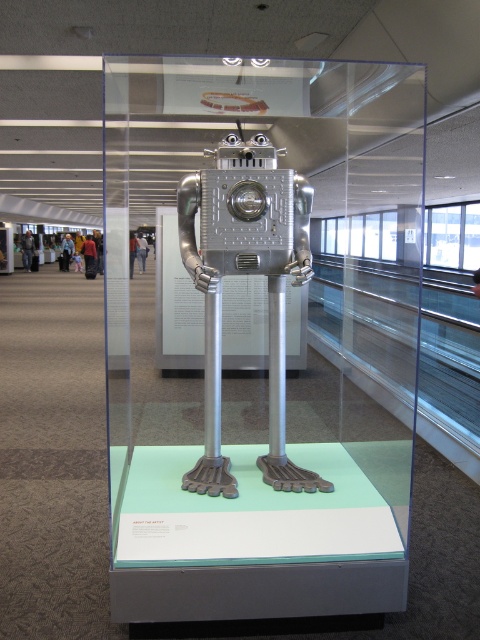
You are an art curator planning to move the transparent glass robot at center and the metallic robot at center to a new exhibition space. The new space has a shelf that can only accommodate one of them due to size constraints. Which robot should you choose to place on the shelf?

The transparent glass robot at center is larger in size than the metallic robot at center, so you should choose the metallic robot at center to place on the shelf since it is smaller and fits the size constraint.

You are an art curator inspecting the sculpture display. You notice two robots in the glass case. Which one is closer to you, the transparent glass robot at center or the metallic robot at center?

The transparent glass robot at center is closer to the viewer than the metallic robot at center.